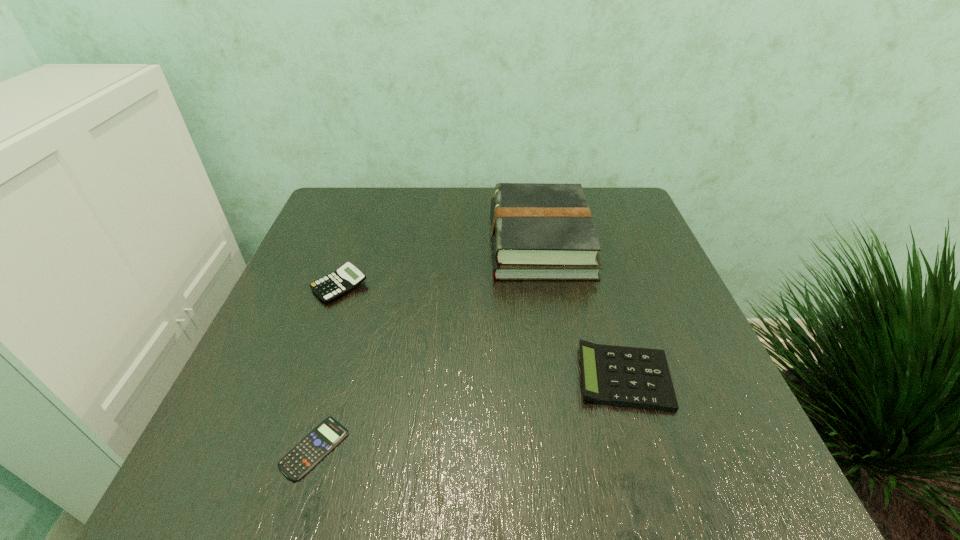
The image size is (960, 540). Identify the location of free space that satisfies the following two spatial constraints: 1. on the spine side of the tallest object; 2. on the back side of the second farthest calculator. (564, 377).